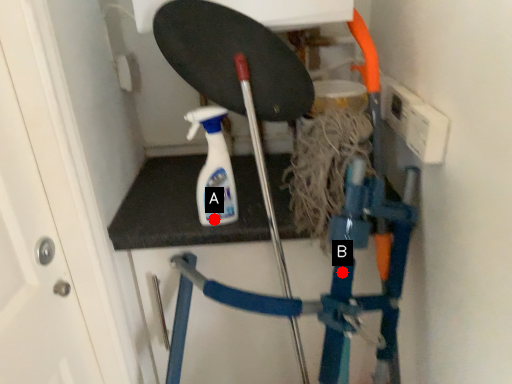
Question: Two points are circled on the image, labeled by A and B beside each circle. Among these points, which one is nearest to the camera?

Choices:
 (A) A is closer
 (B) B is closer

Answer: (B)